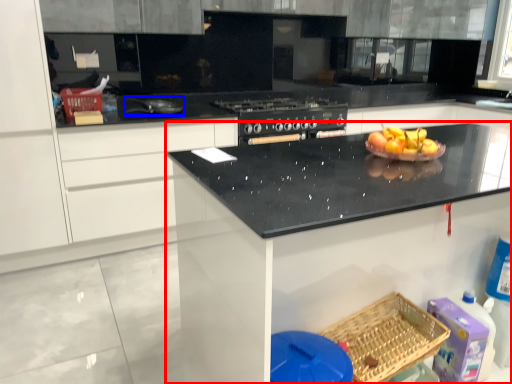
Question: Which object appears closest to the camera in this image, countertop (highlighted by a red box) or appliance (highlighted by a blue box)?

Choices:
 (A) countertop
 (B) appliance

Answer: (A)